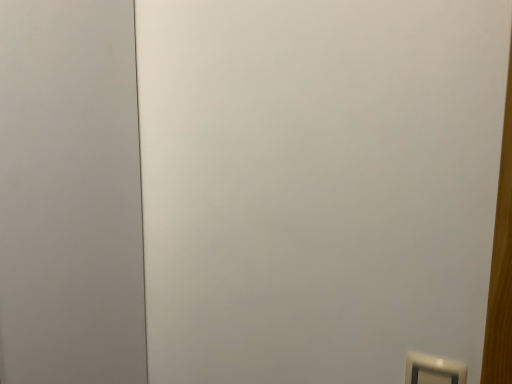
What is the approximate width of white plastic electric outlet at lower right?

white plastic electric outlet at lower right is 2.78 centimeters in width.

What are the coordinates of `white plastic electric outlet at lower right` in the screenshot? It's located at (433, 370).

Describe the element at coordinates (433, 370) in the screenshot. This screenshot has width=512, height=384. I see `white plastic electric outlet at lower right` at that location.

This screenshot has height=384, width=512. In order to click on white plastic electric outlet at lower right in this screenshot , I will do [433, 370].